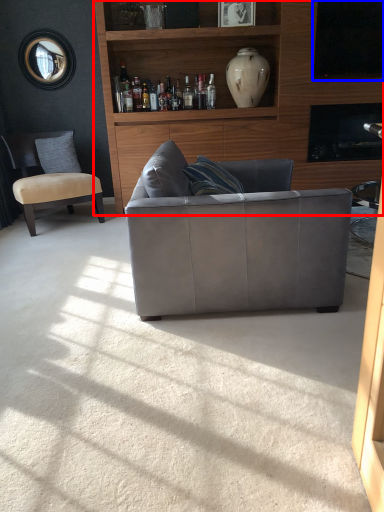
Question: Which object is closer to the camera taking this photo, entertainment center (highlighted by a red box) or window screen (highlighted by a blue box)?

Choices:
 (A) entertainment center
 (B) window screen

Answer: (A)